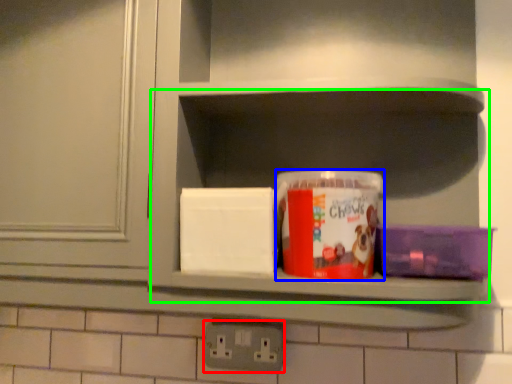
Question: Which object is positioned farthest from electric outlet (highlighted by a red box)? Select from box (highlighted by a blue box) and cabinet (highlighted by a green box).

Choices:
 (A) box
 (B) cabinet

Answer: (B)